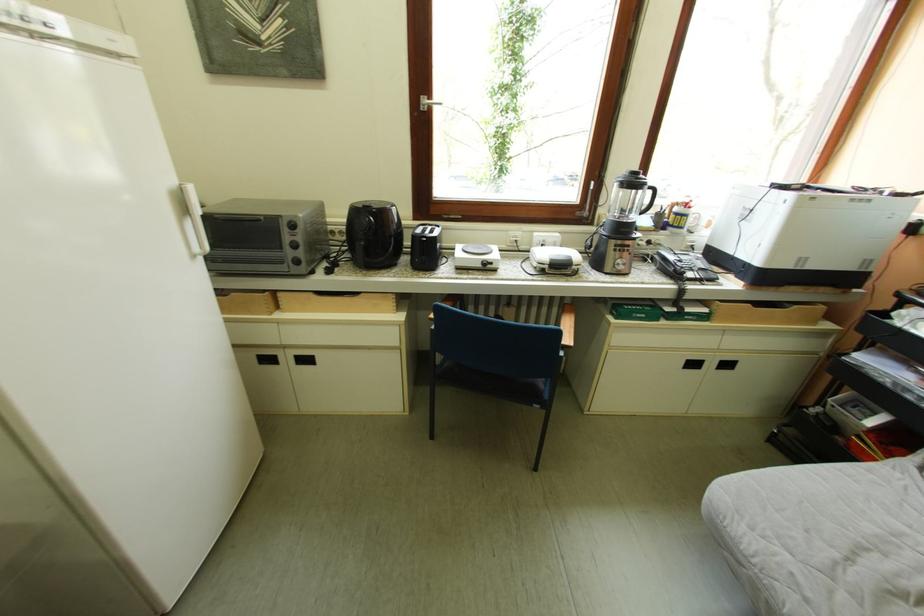
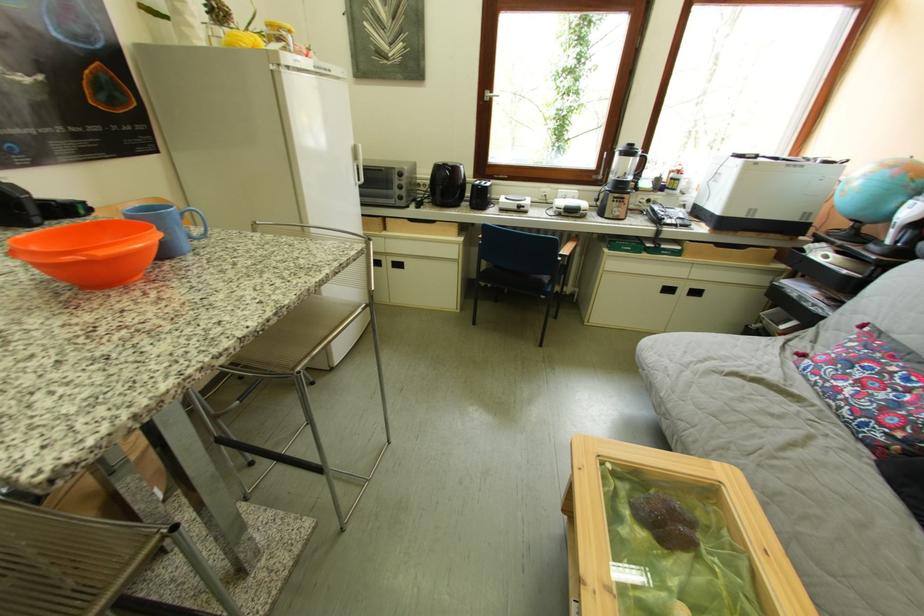
In the second image, find the point that corresponds to (695,370) in the first image.

(672, 294)